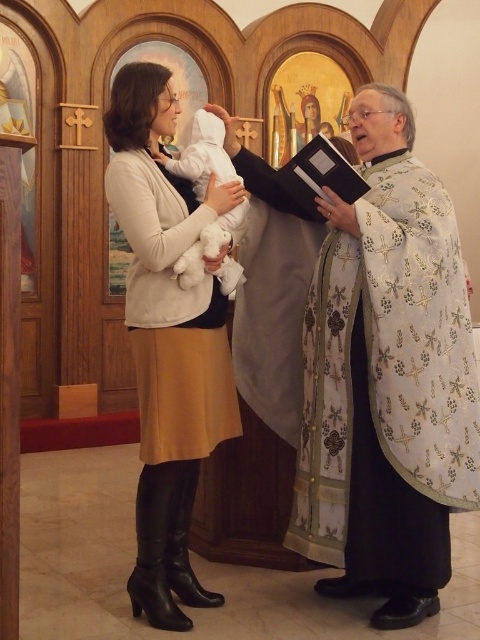
Based on the scene described, which object is shorter between the white embroidered robe at right and the matte white sweater at center?

The white embroidered robe at right is shorter than the matte white sweater at center.

You are an interior designer planning to place a rectangular table between the matte white sweater at center and the white plush at center. The table is 1.2 meters wide. Can the table fit between them without overlapping either object?

The matte white sweater at center might be wider than white plush at center, but since the exact width difference isn not specified, it is uncertain whether the 1.2 meter table can fit between them. Further measurements are needed to confirm.

You are a photographer taking a closeup shot of the two items at the center of the scene. The camera has a maximum focus range of 12 inches. Can you focus on both the matte white sweater at center and the white plush at center simultaneously?

The matte white sweater at center is 12.74 inches away from the white plush at center. Since the distance between them exceeds the camera maximum focus range of 12 inches, you cannot focus on both simultaneously.